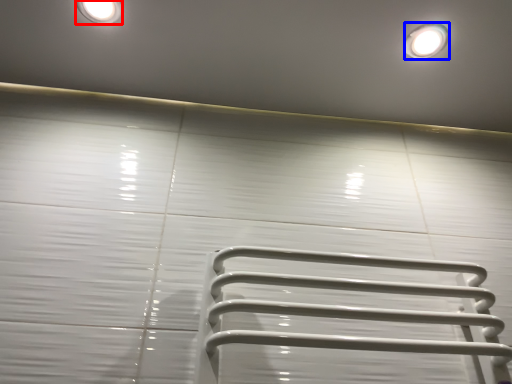
Question: Which object appears farthest to the camera in this image, lighting (highlighted by a red box) or droplight (highlighted by a blue box)?

Choices:
 (A) lighting
 (B) droplight

Answer: (B)